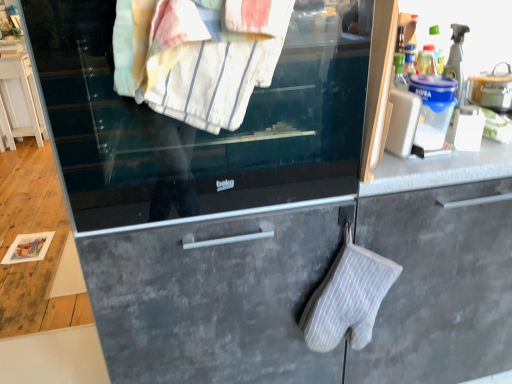
Question: Which is correct: clear glass oven door at center is inside white striped oven mitt at lower center, or outside of it?

Choices:
 (A) outside
 (B) inside

Answer: (A)

Question: In the image, is clear glass oven door at center positioned in front of or behind white striped oven mitt at lower center?

Choices:
 (A) front
 (B) behind

Answer: (A)

Question: Estimate the real-world distances between objects in this image. Which object is closer to the white plastic phone at upper right?

Choices:
 (A) white glossy cabinet at left
 (B) white striped towel at upper center
 (C) white striped oven mitt at lower center
 (D) clear glass oven door at center

Answer: (C)

Question: Based on their relative distances, which object is farther from the white striped oven mitt at lower center?

Choices:
 (A) white striped towel at upper center
 (B) white plastic phone at upper right
 (C) clear glass oven door at center
 (D) white glossy cabinet at left

Answer: (D)